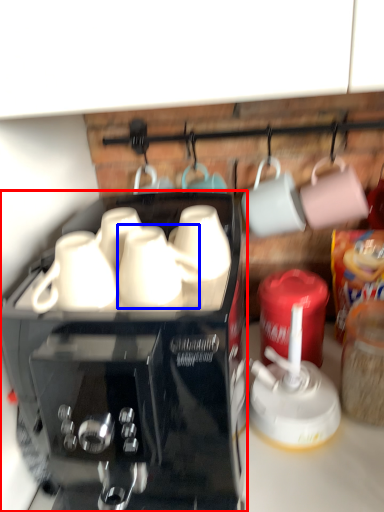
Question: Which object is closer to the camera taking this photo, coffee maker (highlighted by a red box) or mug (highlighted by a blue box)?

Choices:
 (A) coffee maker
 (B) mug

Answer: (A)